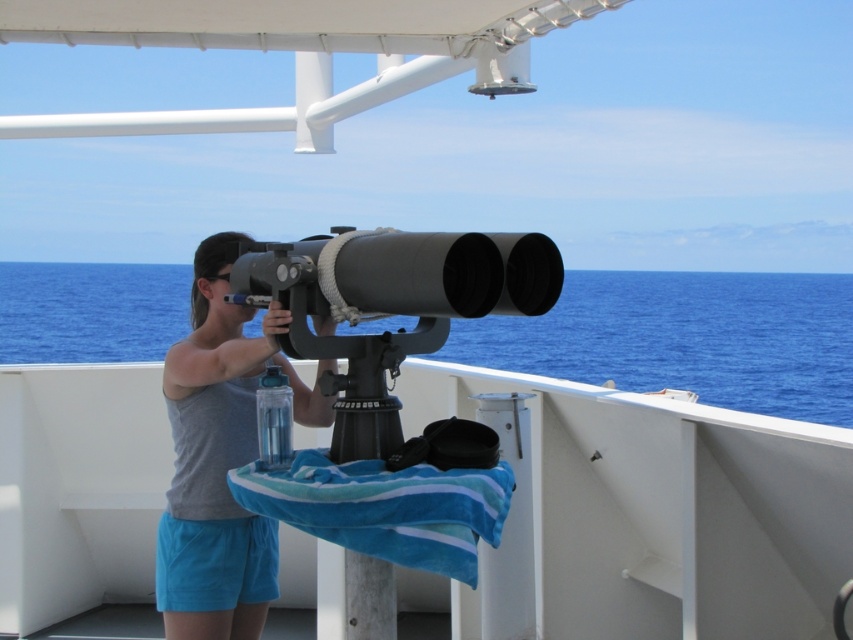
You are a photographer trying to capture the person using the binoculars. You want to ensure the gray matte tank top at center and the matte black telescope at center are both clearly visible in your shot. Based on their positions, which object should you focus on first to ensure both are in focus?

The gray matte tank top at center is located below the matte black telescope at center. To ensure both are in focus, you should focus on the matte black telescope at center first since it is closer to the camera, and the tank top being below it will naturally fall within the depth of field.